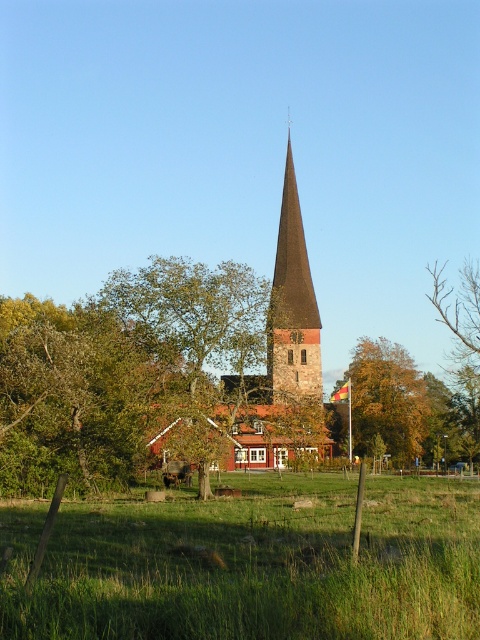
You are standing in the field looking towards the church steeple. Which object, the green leafy tree at left or the yellow autumn leaves at center, is closer to you?

The yellow autumn leaves at center are closer to you because the green leafy tree at left is located above them, meaning it is further away in the scene.

You are a drone operator tasked with capturing aerial footage of the dark brown stone spire at center. Your drone has a maximum flight range of 50 meters. If you launch the drone from the green grass at center, will it be able to reach the spire without exceeding its range limit?

The green grass at center is 49.88 meters from the dark brown stone spire at center. Since the distance is just under the drone s 50 meter range limit, the drone can safely reach the spire without exceeding its maximum flight range.